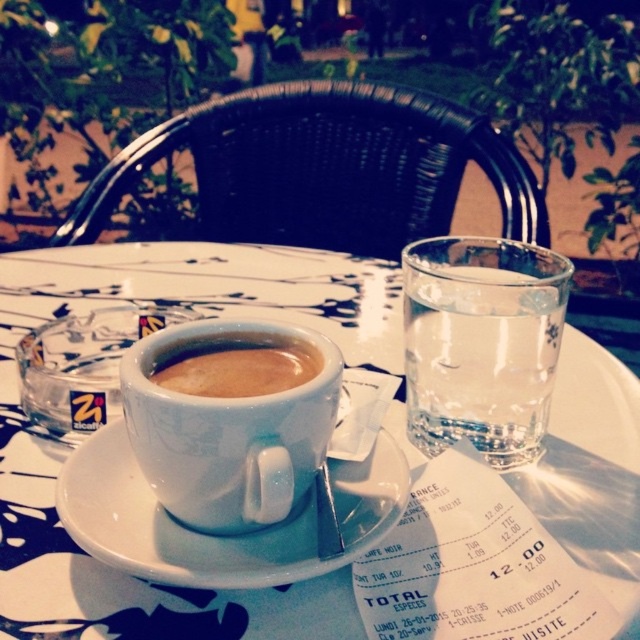
Question: Can you confirm if clear glass water at upper right is positioned below white ceramic saucer at center?

Choices:
 (A) no
 (B) yes

Answer: (A)

Question: Which is farther from the clear glass water at upper right?

Choices:
 (A) white glossy mug at center
 (B) white matte cup of coffee at center
 (C) white ceramic saucer at center

Answer: (B)

Question: Does white ceramic cup at center appear on the right side of white matte cup of coffee at center?

Choices:
 (A) no
 (B) yes

Answer: (A)

Question: Which point is farther from the camera taking this photo?

Choices:
 (A) (314, 406)
 (B) (275, 384)
 (C) (486, 323)
 (D) (106, 538)

Answer: (C)

Question: Which of these objects is positioned farthest from the white matte cup of coffee at center?

Choices:
 (A) white ceramic cup at center
 (B) white glossy mug at center
 (C) clear glass water at upper right

Answer: (A)

Question: Observing the image, what is the correct spatial positioning of white ceramic cup at center in reference to white matte cup of coffee at center?

Choices:
 (A) above
 (B) below

Answer: (A)